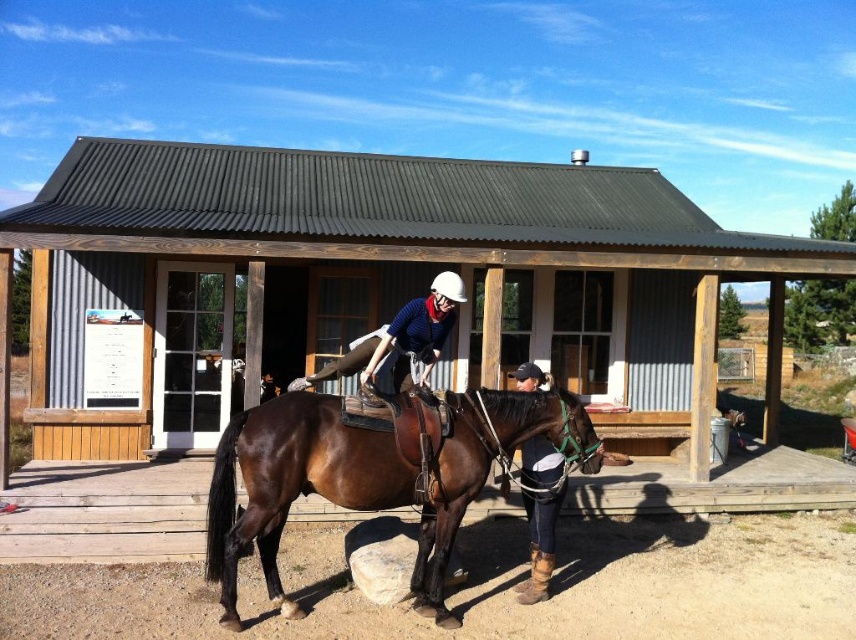
Question: Does brown leather horse at center have a smaller size compared to brown leather boots at lower center?

Choices:
 (A) no
 (B) yes

Answer: (A)

Question: Is brown leather horse at center smaller than brown leather boots at lower center?

Choices:
 (A) no
 (B) yes

Answer: (A)

Question: Which point appears farthest from the camera in this image?

Choices:
 (A) (550, 529)
 (B) (450, 394)

Answer: (A)

Question: Can you confirm if brown leather horse at center is positioned to the left of brown leather boots at lower center?

Choices:
 (A) no
 (B) yes

Answer: (B)